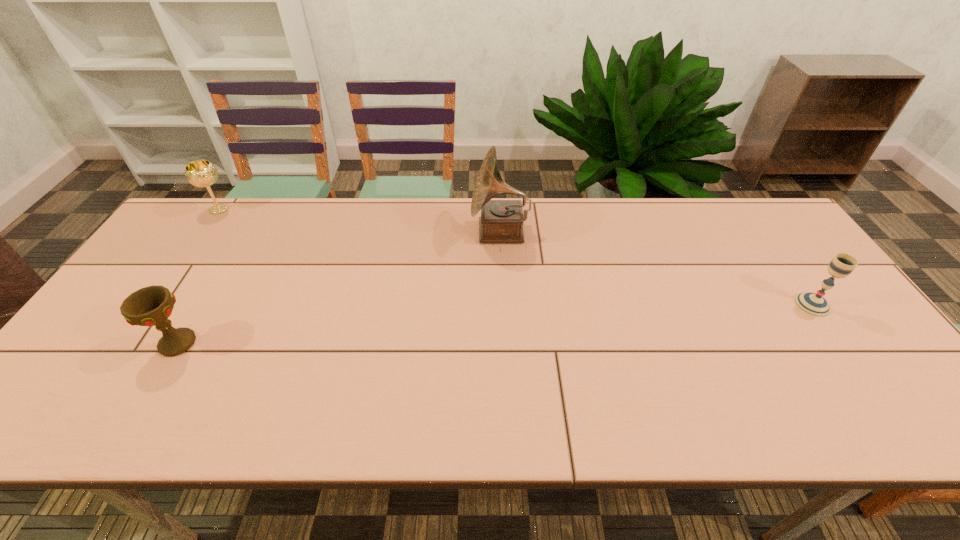
This screenshot has width=960, height=540. I want to click on unoccupied area between the second chalice from right to left and the third farthest object, so click(494, 324).

Where is `free space between the third object from left to right and the leftmost object`? The width and height of the screenshot is (960, 540). free space between the third object from left to right and the leftmost object is located at coordinates (360, 220).

Where is `vacant region between the third object from right to left and the rightmost object`? This screenshot has width=960, height=540. vacant region between the third object from right to left and the rightmost object is located at coordinates (494, 324).

Image resolution: width=960 pixels, height=540 pixels. Find the location of `free space between the leftmost chalice and the third farthest object`. free space between the leftmost chalice and the third farthest object is located at coordinates (516, 257).

Choose which object is the nearest neighbor to the rightmost chalice. Please provide its 2D coordinates. Your answer should be formatted as a tuple, i.e. [(x, y)], where the tuple contains the x and y coordinates of a point satisfying the conditions above.

[(501, 221)]

Select which object is the third closest to the rightmost object. Please provide its 2D coordinates. Your answer should be formatted as a tuple, i.e. [(x, y)], where the tuple contains the x and y coordinates of a point satisfying the conditions above.

[(201, 173)]

The height and width of the screenshot is (540, 960). In order to click on chalice that stands as the closest to the leftmost object in this screenshot , I will do `click(150, 306)`.

Identify the location of chalice identified as the closest to the nearest chalice. (201, 173).

You are a GUI agent. You are given a task and a screenshot of the screen. Output one action in this format:
    pyautogui.click(x=<x>, y=<y>)
    Task: Click on the vacant region that satisfies the following two spatial constraints: 1. on the horn of the second object from right to left; 2. on the left side of the second nearest object
    
    Given the screenshot: What is the action you would take?
    pyautogui.click(x=504, y=305)

This screenshot has height=540, width=960. I want to click on vacant space that satisfies the following two spatial constraints: 1. on the horn of the second farthest chalice; 2. on the right side of the phonograph record, so click(504, 305).